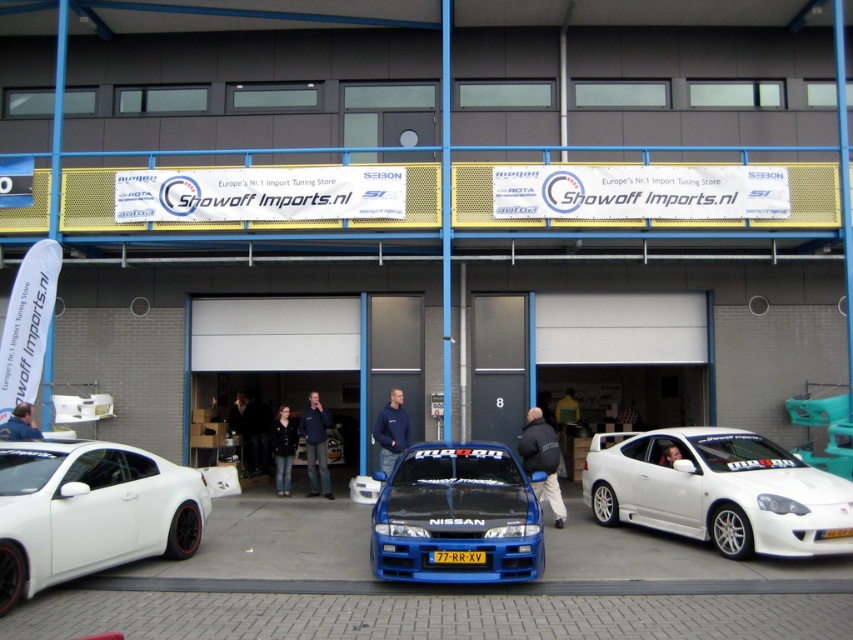
You are standing in front of the car tuning shop and want to measure the distance between yourself and the white glossy car at center. Can you estimate how far you are from it?

The white glossy car at center is 8.88 meters away from the viewer, so you are approximately 8.88 meters away from it.

Based on the photo, you are a delivery person trying to park your van between the white glossy car at center and the yellow matte license plate at center. Can your van, which is 2 meters wide, fit in the space between them?

The white glossy car at center is wider than the yellow matte license plate at center. Since the van is 2 meters wide, it depends on the actual width of the space between them. However, the description only states the car is wider than the license plate, not the distance between them. Therefore, we cannot determine if the van will fit based on the given information.

You are standing in front of the car tuning shop and want to locate the white matte car at lower left. What are the coordinates to find it?

The white matte car at lower left is located at coordinates point (90,512).